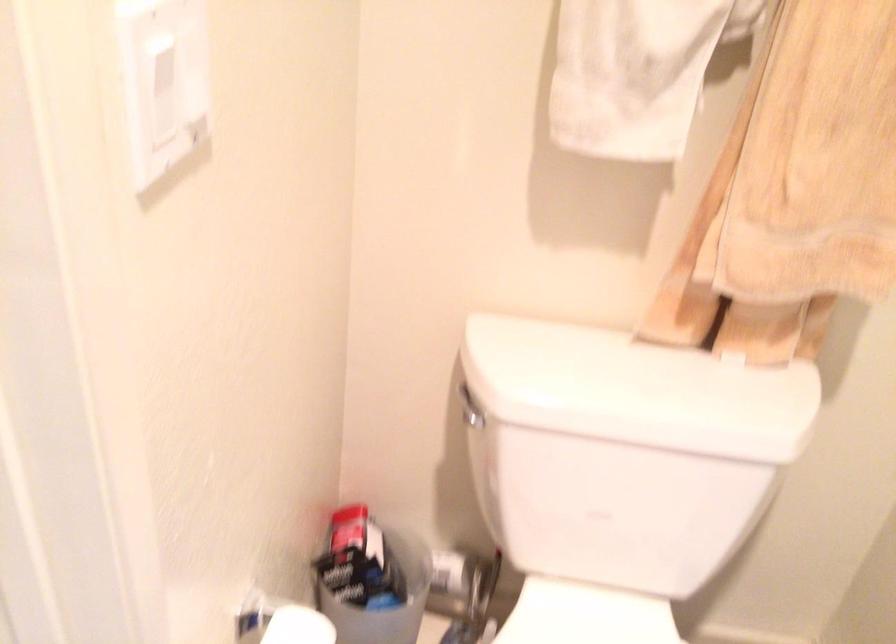
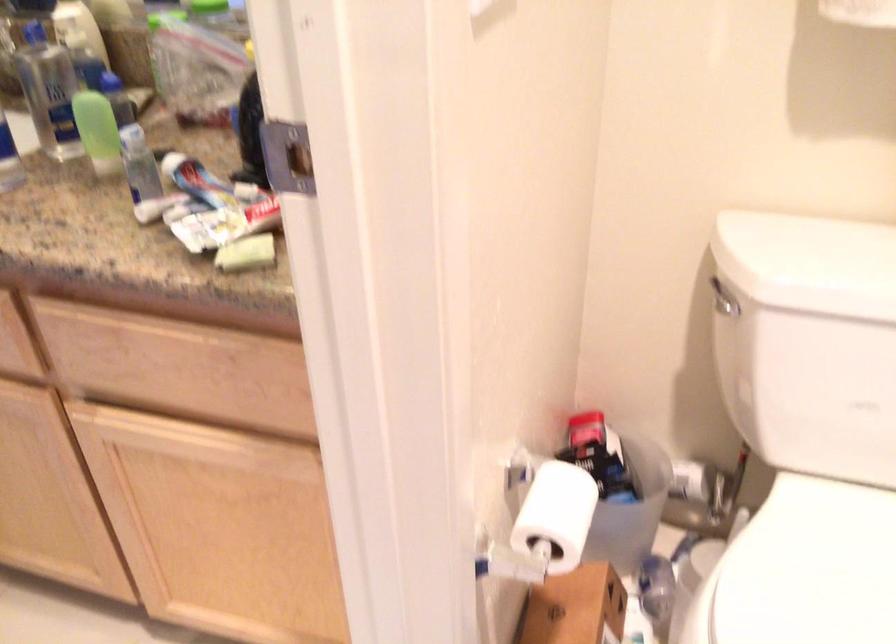
The point at (471, 406) is marked in the first image. Where is the corresponding point in the second image?

(724, 299)